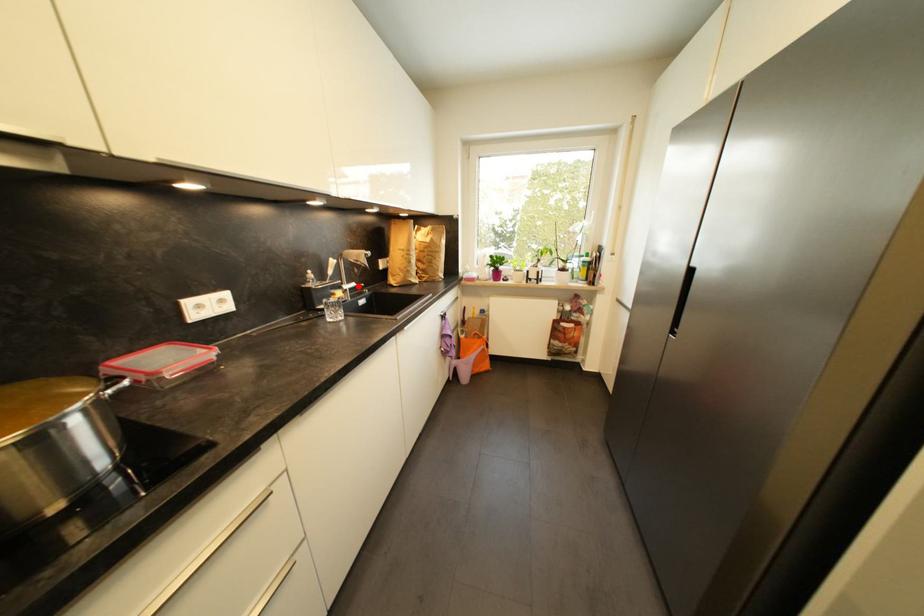
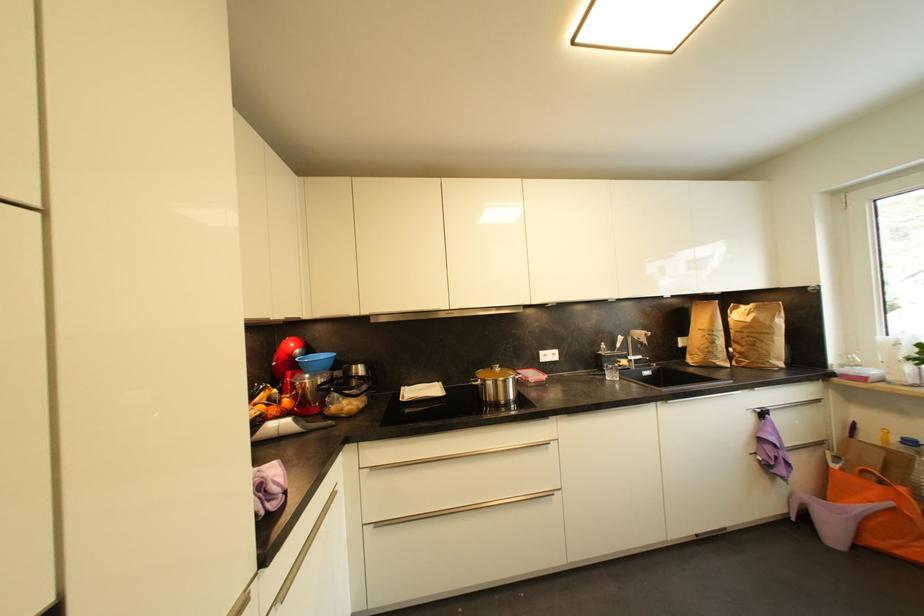
In the second image, find the point that corresponds to the highlighted location in the first image.

(645, 359)